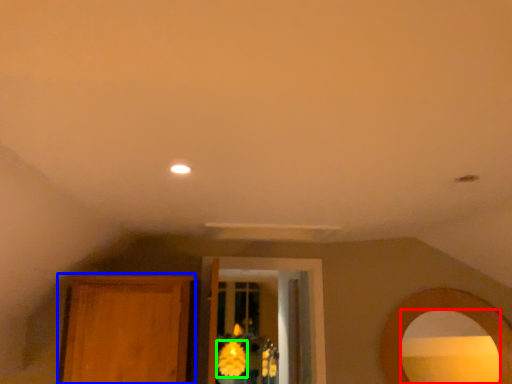
Question: Which object is the closest to the mirror (highlighted by a red box)? Choose among these: armoire (highlighted by a blue box) or flower (highlighted by a green box).

Choices:
 (A) armoire
 (B) flower

Answer: (A)